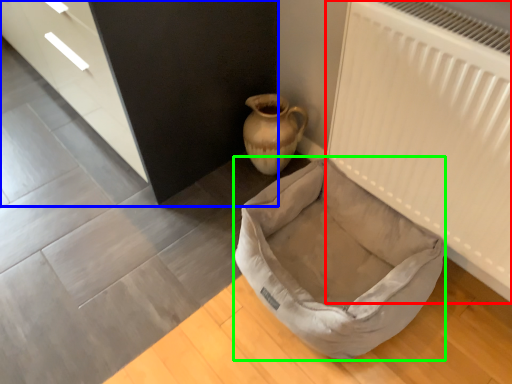
Question: Which object is the closest to the radiator (highlighted by a red box)? Choose among these: dresser (highlighted by a blue box) or dog bed (highlighted by a green box).

Choices:
 (A) dresser
 (B) dog bed

Answer: (B)